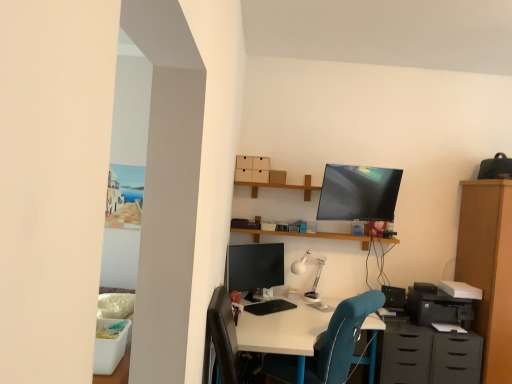
Question: Can you confirm if matte black monitor at center is smaller than white matte desk lamp at center?

Choices:
 (A) yes
 (B) no

Answer: (B)

Question: Is matte black monitor at center at the right side of white matte desk lamp at center?

Choices:
 (A) no
 (B) yes

Answer: (A)

Question: Could you tell me if matte black monitor at center is turned towards white matte desk lamp at center?

Choices:
 (A) yes
 (B) no

Answer: (B)

Question: From a real-world perspective, is matte black monitor at center below white matte desk lamp at center?

Choices:
 (A) yes
 (B) no

Answer: (B)

Question: Can we say matte black monitor at center lies outside white matte desk lamp at center?

Choices:
 (A) no
 (B) yes

Answer: (B)

Question: Visually, is white matte desk lamp at center positioned to the left or to the right of wooden shelf at upper center?

Choices:
 (A) left
 (B) right

Answer: (A)

Question: In terms of width, does white matte desk lamp at center look wider or thinner when compared to wooden shelf at upper center?

Choices:
 (A) wide
 (B) thin

Answer: (A)

Question: Is white matte desk lamp at center taller or shorter than wooden shelf at upper center?

Choices:
 (A) short
 (B) tall

Answer: (B)

Question: Considering the positions of white matte desk lamp at center and wooden shelf at upper center in the image, is white matte desk lamp at center bigger or smaller than wooden shelf at upper center?

Choices:
 (A) small
 (B) big

Answer: (A)

Question: Is point (309, 379) positioned closer to the camera than point (419, 301)?

Choices:
 (A) farther
 (B) closer

Answer: (B)

Question: Considering the relative positions of teal fabric chair at center and black plastic printer at lower right in the image provided, is teal fabric chair at center to the left or to the right of black plastic printer at lower right?

Choices:
 (A) right
 (B) left

Answer: (B)

Question: In terms of height, does teal fabric chair at center look taller or shorter compared to black plastic printer at lower right?

Choices:
 (A) tall
 (B) short

Answer: (A)

Question: Looking at their shapes, would you say teal fabric chair at center is wider or thinner than black plastic printer at lower right?

Choices:
 (A) thin
 (B) wide

Answer: (B)

Question: Based on their positions, is wooden shelf at upper center located to the left or right of white matte desk lamp at center?

Choices:
 (A) right
 (B) left

Answer: (A)

Question: From the image's perspective, relative to white matte desk lamp at center, is wooden shelf at upper center above or below?

Choices:
 (A) above
 (B) below

Answer: (A)